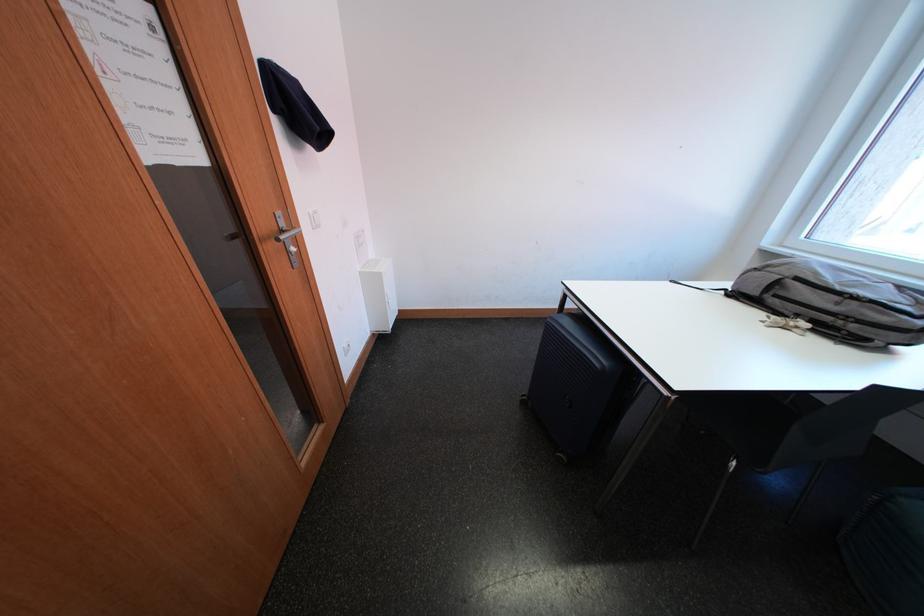
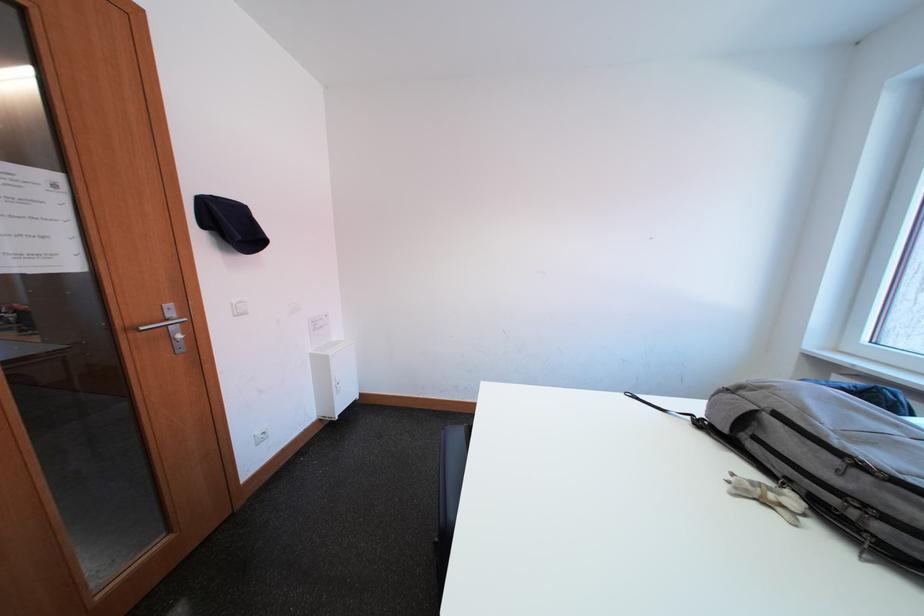
Question: How did the camera likely rotate?

Choices:
 (A) Left
 (B) Right
 (C) Up
 (D) Down

Answer: (C)